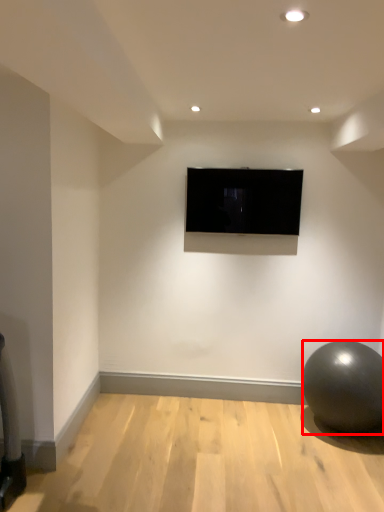
Question: Where is ball (annotated by the red box) located in relation to television in the image?

Choices:
 (A) left
 (B) right

Answer: (B)